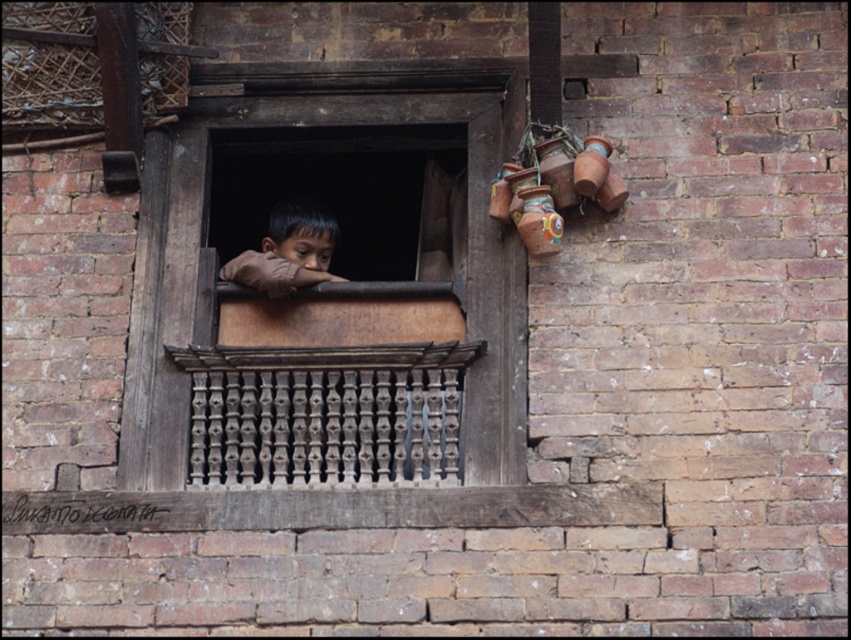
Who is positioned more to the right, dark brown wood at center or brown leather child at center?

From the viewer's perspective, dark brown wood at center appears more on the right side.

Who is taller, dark brown wood at center or brown leather child at center?

Standing taller between the two is dark brown wood at center.

At what (x,y) coordinates should I click in order to perform the action: click on dark brown wood at center. Please return your answer as a coordinate pair (x, y). This screenshot has height=640, width=851. Looking at the image, I should click on tap(324, 124).

Locate an element on the screen. The image size is (851, 640). dark brown wood at center is located at coordinates (324, 124).